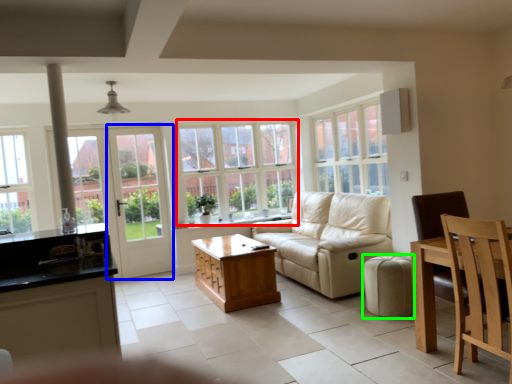
Question: Based on their relative distances, which object is nearer to window (highlighted by a red box)? Choose from screen door (highlighted by a blue box) and stool (highlighted by a green box).

Choices:
 (A) screen door
 (B) stool

Answer: (A)